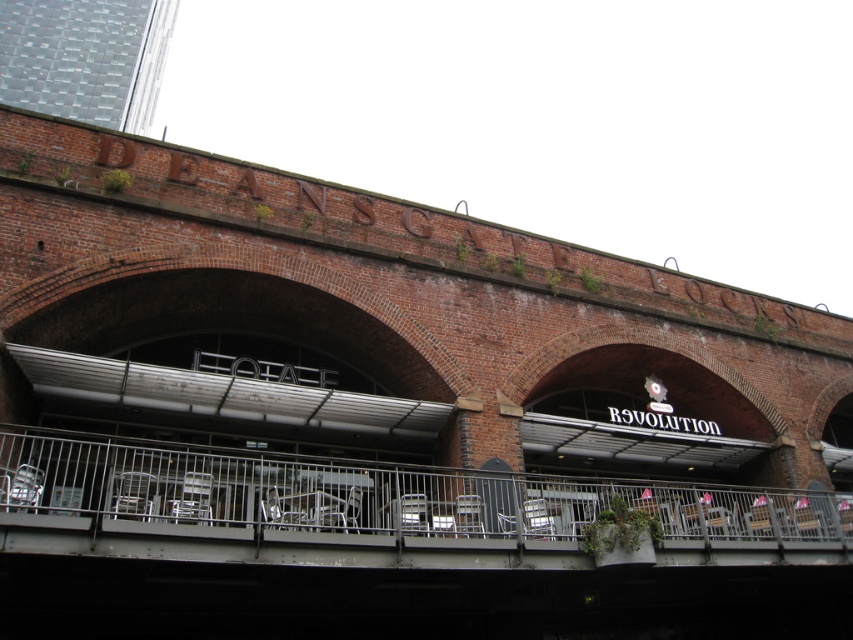
You are standing in front of the brick building and want to place a small potted plant between the brick at center and the metallic gray railing at center. Based on their positions, which object should the plant be closer to?

The brick at center is positioned on the right side of metallic gray railing at center, so the plant should be placed between them, closer to the metallic gray railing at center since the brick is to its right.

You are standing in front of the brick building with arched openings. There are two points marked on the building. The first point is at coordinates point (769, 534) and the second point is at point (375, 518). Which point is closer to you?

Point (769, 534) is further to the viewer than point (375, 518), so the point closer to you is point (375, 518).